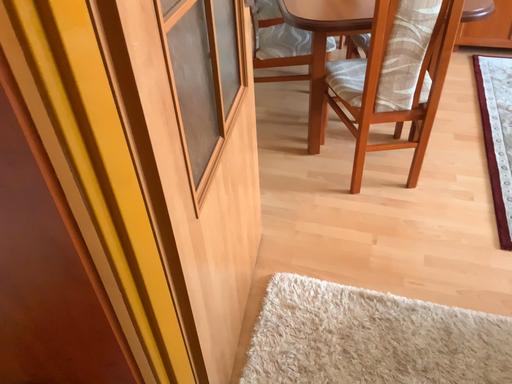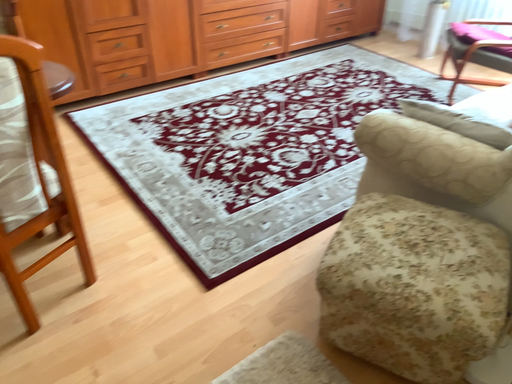
Question: How did the camera likely rotate when shooting the video?

Choices:
 (A) rotated left
 (B) rotated right

Answer: (B)